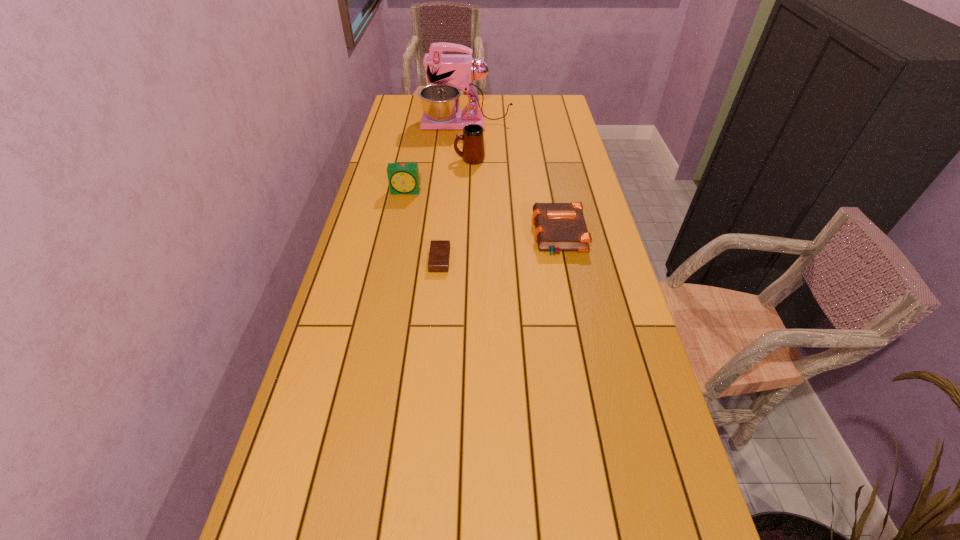
Locate an element on the screen. The width and height of the screenshot is (960, 540). vacant space located 0.100m on the face of the mixer is located at coordinates (398, 124).

Where is `vacant area located on the side of the fourth nearest object with the handle`? vacant area located on the side of the fourth nearest object with the handle is located at coordinates (423, 160).

What are the coordinates of `vacant space located on the side of the fourth nearest object with the handle` in the screenshot? It's located at (411, 160).

Where is `blank space located on the side of the fourth nearest object with the handle`? The width and height of the screenshot is (960, 540). blank space located on the side of the fourth nearest object with the handle is located at coordinates (393, 160).

Image resolution: width=960 pixels, height=540 pixels. I want to click on free space located on the front-facing side of the left alarm clock, so click(395, 248).

Image resolution: width=960 pixels, height=540 pixels. I want to click on vacant space located 0.250m on the spine side of the second shortest object, so click(x=453, y=235).

Where is `free location located 0.340m on the spine side of the second shortest object`? The width and height of the screenshot is (960, 540). free location located 0.340m on the spine side of the second shortest object is located at coordinates (425, 235).

The height and width of the screenshot is (540, 960). I want to click on blank space located on the spine side of the second shortest object, so click(x=495, y=235).

Locate an element on the screen. This screenshot has height=540, width=960. vacant space situated on the front face of the nearer alarm clock is located at coordinates (567, 260).

Identify the location of object at the far edge. (440, 102).